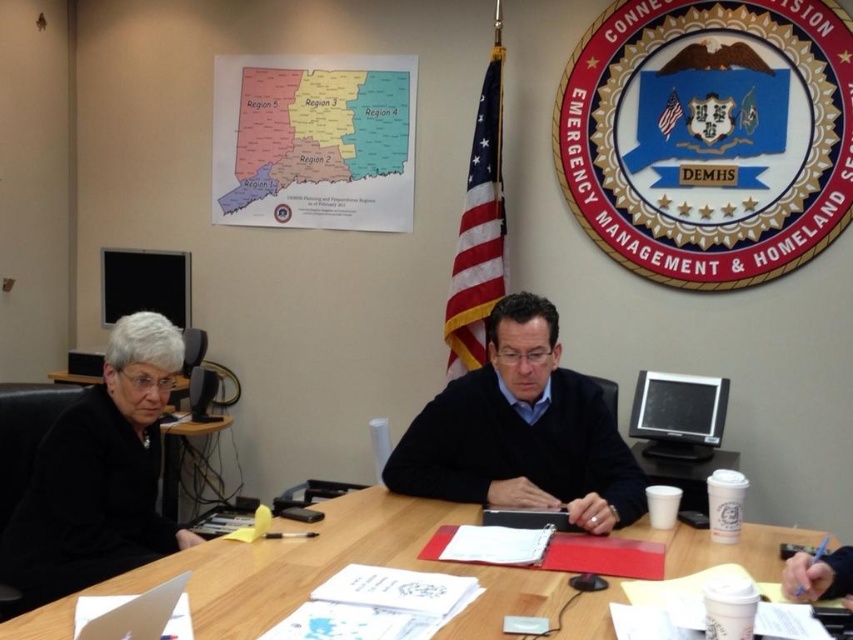
You are an office assistant who needs to retrieve the white paper cup at center. Can you reach it without moving the black sweater at center?

The black sweater at center is positioned over the white paper cup at center, so you cannot reach the white paper cup without moving the black sweater.

From the picture: You are a photographer standing behind the camera. You want to take a photo of the black sweater at center without it being too blurry. The camera requires a subject to be at least 2 meters away to avoid blur. Can you take the photo from your current position?

The black sweater at center and camera are 1.86 meters apart, which is less than the required 2 meters. Therefore, you cannot take the photo from your current position without the sweater being blurry.

You are standing at the entrance of the meeting room and see two points marked on the floor. The first point is at position point (540,346) and the second point is at point (161,408). If you want to walk from the entrance to the first point without crossing the second point, which direction should you move relative to the second point?

Point (540,346) is behind point (161,408), so you should move in a direction away from the second point to reach the first point without crossing it.